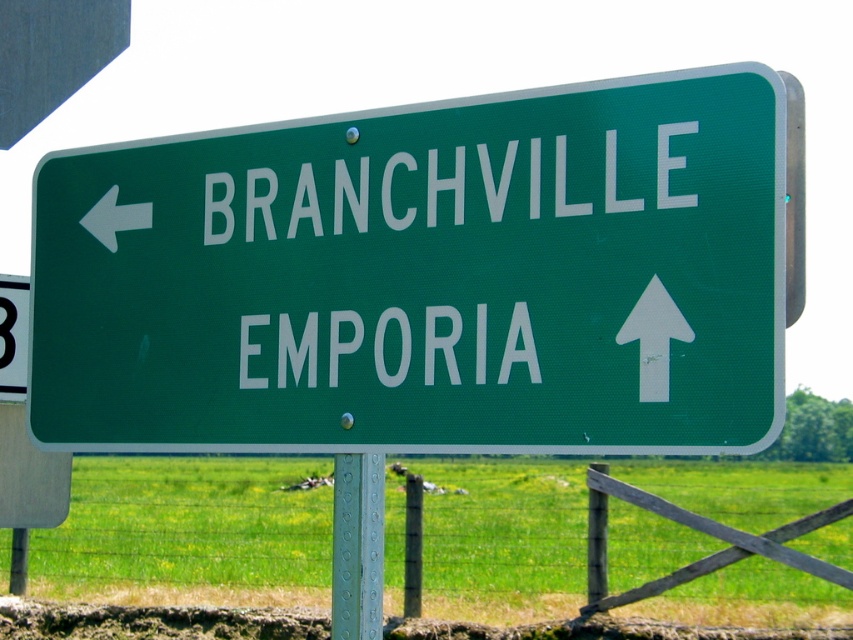
Question: Does metallic gray pole at center have a larger size compared to white paper arrow at upper center?

Choices:
 (A) yes
 (B) no

Answer: (A)

Question: In this image, where is wooden at center located relative to whitematerial/textureemporia at upper center?

Choices:
 (A) below
 (B) above

Answer: (A)

Question: Which of the following is the farthest from the observer?

Choices:
 (A) (392, 204)
 (B) (206, 580)

Answer: (B)

Question: Among these objects, which one is nearest to the camera?

Choices:
 (A) green matte sign at center
 (B) white matte arrow at left
 (C) white paper arrow at upper center

Answer: (A)

Question: Is wooden at center positioned at the back of whitematerial/textureemporia at upper center?

Choices:
 (A) no
 (B) yes

Answer: (A)

Question: Among these objects, which one is nearest to the camera?

Choices:
 (A) whitematerial/texture at upper center
 (B) white paper arrow at upper center

Answer: (B)